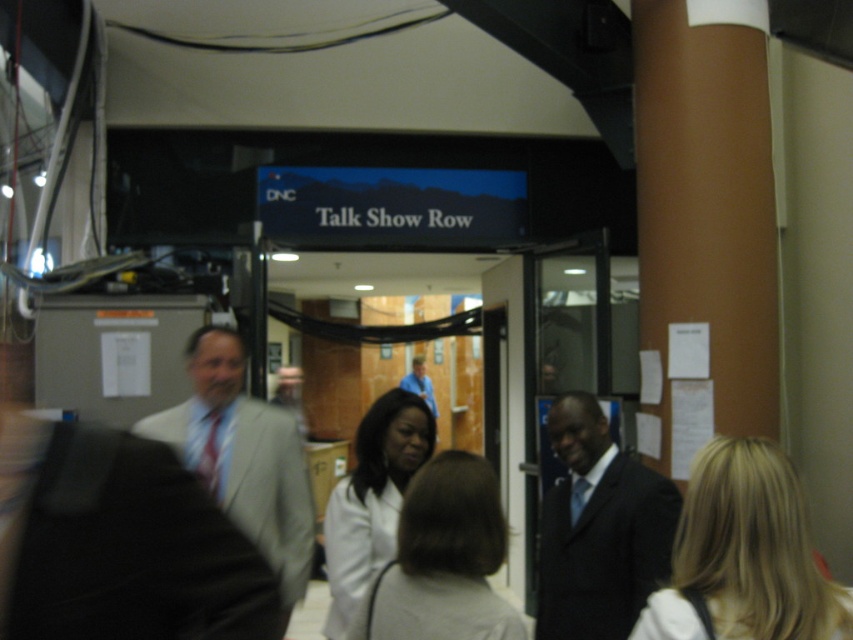
You are a photographer at the DNC event. You want to capture a candid shot of the light brown hair at center without including the light gray suit at center in the frame. Is this possible given their positions?

The light brown hair at center is behind the light gray suit at center, so it might be challenging to capture the light brown hair at center without including the light gray suit at center in the frame.

You are a photographer at the DNC event and need to capture a photo of both the light gray fabric business suit at center and the white matte coat at center. Which of the two should you focus on first if you want to ensure the taller object is in frame?

The white matte coat at center is taller than the light gray fabric business suit at center, so you should focus on the white matte coat at center first to ensure the taller object is in frame.

You are a photographer at the DNC event and need to capture a photo of the light gray fabric business suit at center and the light brown hair at center. Which object should you focus on first if you want to photograph them both clearly in one frame?

The light gray fabric business suit at center is to the left of light brown hair at center, so you should focus on the light gray fabric business suit at center first to ensure both are in clear view.